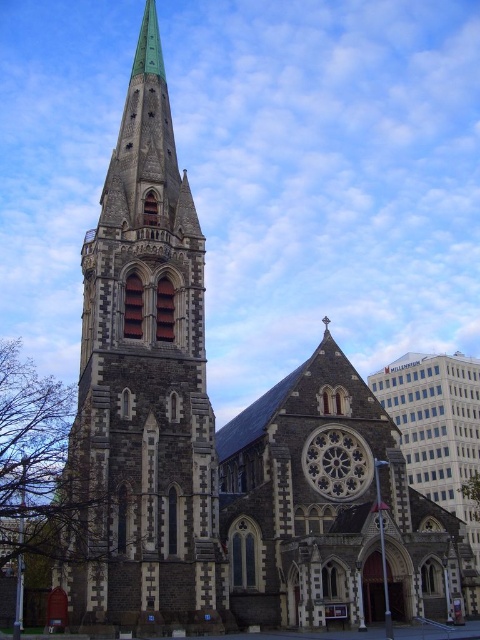
Is point (154, 467) less distant than point (372, 468)?

Yes, it is in front of point (372, 468).

Measure the distance from stone steeple at left to dark gray stone clock at center.

stone steeple at left and dark gray stone clock at center are 24.44 meters apart.

Measure the distance between stone steeple at left and camera.

stone steeple at left is 49.59 meters away from camera.

You are a GUI agent. You are given a task and a screenshot of the screen. Output one action in this format:
    pyautogui.click(x=<x>, y=<y>)
    Task: Click on the stone steeple at left
    This screenshot has width=480, height=640.
    Given the screenshot: What is the action you would take?
    pyautogui.click(x=144, y=387)